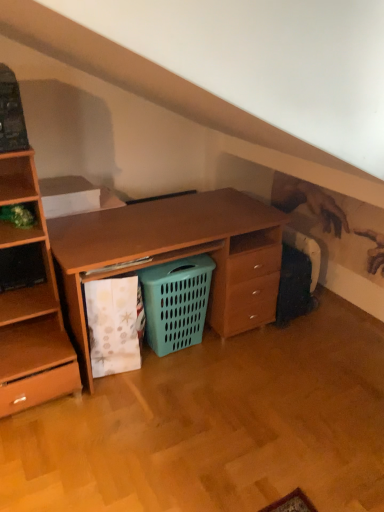
Describe the element at coordinates (176, 302) in the screenshot. This screenshot has height=512, width=384. I see `teal plastic laundry basket at center` at that location.

I want to click on teal plastic laundry basket at center, so click(176, 302).

Describe the element at coordinates (22, 231) in the screenshot. This screenshot has width=384, height=512. I see `green matte plant at left` at that location.

This screenshot has height=512, width=384. Find the location of `green matte plant at left`. green matte plant at left is located at coordinates (22, 231).

Image resolution: width=384 pixels, height=512 pixels. What are the coordinates of `teal plastic laundry basket at center` in the screenshot? It's located at (176, 302).

Considering the relative positions of green matte plant at left and teal plastic laundry basket at center in the image provided, is green matte plant at left to the left or to the right of teal plastic laundry basket at center?

In the image, green matte plant at left appears on the left side of teal plastic laundry basket at center.

Does green matte plant at left lie in front of teal plastic laundry basket at center?

Yes, it is in front of teal plastic laundry basket at center.

Is point (16, 234) positioned behind point (171, 329)?

No, it is in front of (171, 329).

From the image's perspective, does green matte plant at left appear lower than teal plastic laundry basket at center?

Incorrect, from the image's perspective, green matte plant at left is higher than teal plastic laundry basket at center.

Consider the image. From a real-world perspective, is green matte plant at left positioned above or below teal plastic laundry basket at center?

green matte plant at left is situated higher than teal plastic laundry basket at center in the real world.

Considering the relative sizes of green matte plant at left and teal plastic laundry basket at center in the image provided, is green matte plant at left wider than teal plastic laundry basket at center?

Indeed, green matte plant at left has a greater width compared to teal plastic laundry basket at center.

Does green matte plant at left have a lesser height compared to teal plastic laundry basket at center?

Indeed, green matte plant at left has a lesser height compared to teal plastic laundry basket at center.

Considering the sizes of objects green matte plant at left and teal plastic laundry basket at center in the image provided, who is smaller, green matte plant at left or teal plastic laundry basket at center?

With smaller size is green matte plant at left.

Is green matte plant at left completely or partially outside of teal plastic laundry basket at center?

green matte plant at left lies outside teal plastic laundry basket at center's area.

Is green matte plant at left not close to teal plastic laundry basket at center?

green matte plant at left is near teal plastic laundry basket at center, not far away.

Is green matte plant at left positioned with its back to teal plastic laundry basket at center?

That's not correct — green matte plant at left is not looking away from teal plastic laundry basket at center.

Can you tell me how much green matte plant at left and teal plastic laundry basket at center differ in facing direction?

The facing directions of green matte plant at left and teal plastic laundry basket at center are 1.98 degrees apart.

Image resolution: width=384 pixels, height=512 pixels. In order to click on shopping basket behind the green matte plant at left in this screenshot , I will do `click(176, 302)`.

In the scene shown: Does teal plastic laundry basket at center appear on the left side of green matte plant at left?

No, teal plastic laundry basket at center is not to the left of green matte plant at left.

Is teal plastic laundry basket at center further to the viewer compared to green matte plant at left?

Yes, it is behind green matte plant at left.

Is point (192, 290) positioned in front of point (4, 229)?

No, it is behind (4, 229).

From the image's perspective, is teal plastic laundry basket at center beneath green matte plant at left?

Yes, from the image's perspective, teal plastic laundry basket at center is beneath green matte plant at left.

From a real-world perspective, is teal plastic laundry basket at center above or below green matte plant at left?

In terms of real-world spatial position, teal plastic laundry basket at center is below green matte plant at left.

Is teal plastic laundry basket at center thinner than green matte plant at left?

Yes, teal plastic laundry basket at center is thinner than green matte plant at left.

Is teal plastic laundry basket at center taller than green matte plant at left?

Yes.

From the picture: Does teal plastic laundry basket at center have a larger size compared to green matte plant at left?

Correct, teal plastic laundry basket at center is larger in size than green matte plant at left.

Would you say teal plastic laundry basket at center is outside green matte plant at left?

Indeed, teal plastic laundry basket at center is completely outside green matte plant at left.

Are teal plastic laundry basket at center and green matte plant at left located far from each other?

No, teal plastic laundry basket at center is not far away from green matte plant at left.

Is teal plastic laundry basket at center oriented away from green matte plant at left?

No.

At what (x,y) coordinates should I click in order to perform the action: click on shelf above the teal plastic laundry basket at center (from the image's perspective). Please return your answer as a coordinate pair (x, y). The width and height of the screenshot is (384, 512). Looking at the image, I should click on (22, 231).

I want to click on shelf in front of the teal plastic laundry basket at center, so click(x=22, y=231).

Identify the location of shelf above the teal plastic laundry basket at center (from a real-world perspective). This screenshot has height=512, width=384. (x=22, y=231).